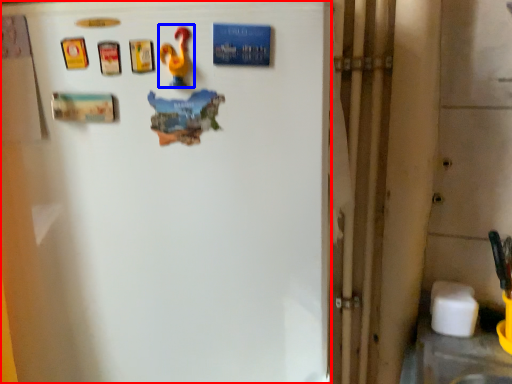
Question: Which object appears closest to the camera in this image, refrigerator (highlighted by a red box) or toy (highlighted by a blue box)?

Choices:
 (A) refrigerator
 (B) toy

Answer: (A)